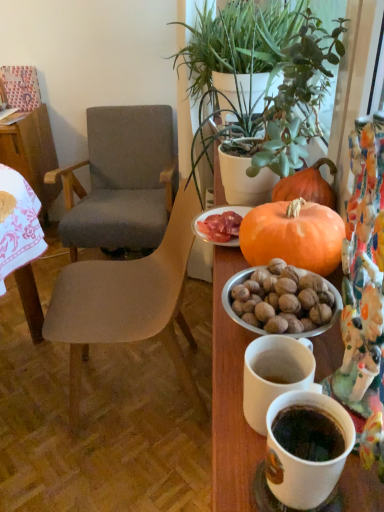
Question: Considering the relative positions of textured gray fabric chair at left, which is counted as the 2th chair, starting from the back, and gray fabric chair at center, the first chair viewed from the back, in the image provided, is textured gray fabric chair at left, which is counted as the 2th chair, starting from the back, to the right of gray fabric chair at center, the first chair viewed from the back, from the viewer's perspective?

Choices:
 (A) no
 (B) yes

Answer: (B)

Question: Is textured gray fabric chair at left, which is counted as the 2th chair, starting from the back, at the left side of gray fabric chair at center, the first chair viewed from the back?

Choices:
 (A) no
 (B) yes

Answer: (A)

Question: From a real-world perspective, does textured gray fabric chair at left, which is counted as the 2th chair, starting from the back, stand above gray fabric chair at center, which is the second chair from front to back?

Choices:
 (A) yes
 (B) no

Answer: (A)

Question: Does textured gray fabric chair at left, the 1th chair in the front-to-back sequence, have a greater width compared to gray fabric chair at center, which is the second chair from front to back?

Choices:
 (A) no
 (B) yes

Answer: (A)

Question: Considering the relative sizes of textured gray fabric chair at left, the 1th chair in the front-to-back sequence, and gray fabric chair at center, the first chair viewed from the back, in the image provided, is textured gray fabric chair at left, the 1th chair in the front-to-back sequence, thinner than gray fabric chair at center, the first chair viewed from the back,?

Choices:
 (A) no
 (B) yes

Answer: (B)

Question: Considering the relative sizes of textured gray fabric chair at left, the 1th chair in the front-to-back sequence, and gray fabric chair at center, the first chair viewed from the back, in the image provided, is textured gray fabric chair at left, the 1th chair in the front-to-back sequence, taller than gray fabric chair at center, the first chair viewed from the back,?

Choices:
 (A) no
 (B) yes

Answer: (A)

Question: Is orange matte pumpkin at center wider than wooden table at left?

Choices:
 (A) no
 (B) yes

Answer: (A)

Question: Are orange matte pumpkin at center and wooden table at left located far from each other?

Choices:
 (A) no
 (B) yes

Answer: (B)

Question: Is orange matte pumpkin at center shorter than wooden table at left?

Choices:
 (A) no
 (B) yes

Answer: (B)

Question: From the image's perspective, is orange matte pumpkin at center on wooden table at left?

Choices:
 (A) no
 (B) yes

Answer: (A)

Question: From the image's perspective, is orange matte pumpkin at center under wooden table at left?

Choices:
 (A) no
 (B) yes

Answer: (B)

Question: Is the position of orange matte pumpkin at center less distant than that of wooden table at left?

Choices:
 (A) no
 (B) yes

Answer: (B)

Question: Is orange matte pumpkin at center wider than textured gray fabric chair at left, which is counted as the 2th chair, starting from the back?

Choices:
 (A) no
 (B) yes

Answer: (A)